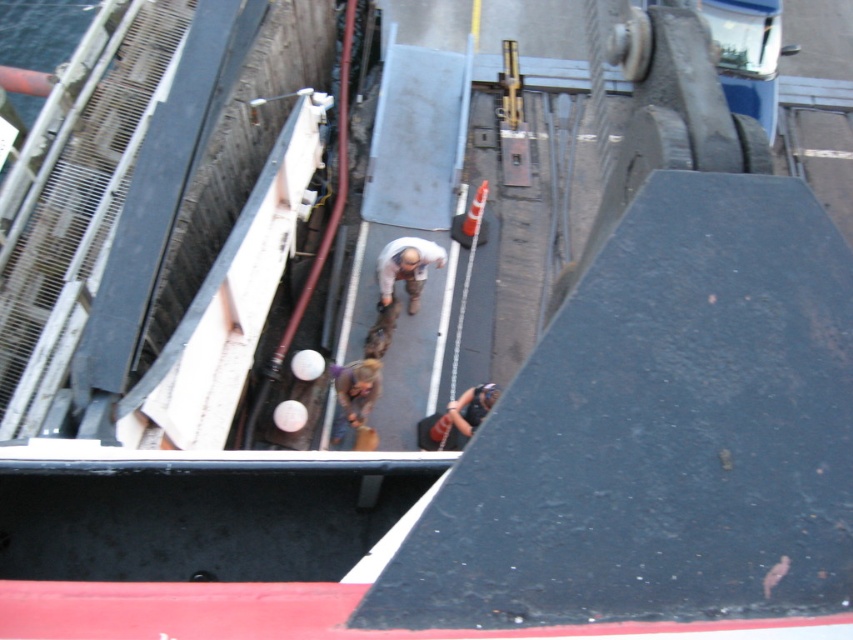
You are observing a person standing on the walkway in the shipyard. The person is wearing a light brown fabric pants at center and a brown leather jacket at center. Which piece of clothing is more to the right?

The light brown fabric pants at center is positioned on the right side of brown leather jacket at center, so the light brown fabric pants at center is more to the right.

You are an observer standing on the walkway looking towards the ship. You notice a person wearing light brown fabric pants at center and a brown leather jacket at center. Which piece of clothing is closer to you?

The light brown fabric pants at center are closer to you because the brown leather jacket at center is behind them.

You are a safety inspector on a ship and need to ensure that the brown leather jacket at center and the matte black helmet at upper center are within a 30 inch safety distance. Based on the scene, are they within the required distance?

The brown leather jacket at center and the matte black helmet at upper center are 28.02 inches apart from each other, which is within the 30 inch safety distance requirement.